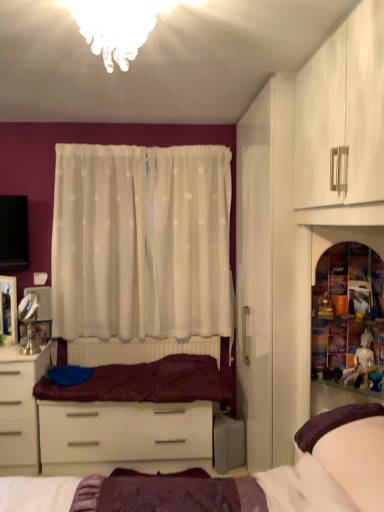
Question: Considering the relative positions of translucent glass shelf at right and white glossy desk at lower left in the image provided, is translucent glass shelf at right to the right of white glossy desk at lower left from the viewer's perspective?

Choices:
 (A) yes
 (B) no

Answer: (A)

Question: From the image's perspective, does translucent glass shelf at right appear lower than white glossy desk at lower left?

Choices:
 (A) no
 (B) yes

Answer: (A)

Question: Is translucent glass shelf at right thinner than white glossy desk at lower left?

Choices:
 (A) yes
 (B) no

Answer: (A)

Question: Is translucent glass shelf at right closer to the viewer compared to white glossy desk at lower left?

Choices:
 (A) no
 (B) yes

Answer: (B)

Question: Can you confirm if translucent glass shelf at right is taller than white glossy desk at lower left?

Choices:
 (A) yes
 (B) no

Answer: (A)

Question: Relative to white glossy drawer at center, is white glossy desk at lower left in front or behind?

Choices:
 (A) front
 (B) behind

Answer: (A)

Question: Is white glossy desk at lower left bigger or smaller than white glossy drawer at center?

Choices:
 (A) small
 (B) big

Answer: (A)

Question: From the image's perspective, relative to white glossy drawer at center, is white glossy desk at lower left above or below?

Choices:
 (A) above
 (B) below

Answer: (A)

Question: Based on their positions, is white glossy desk at lower left located to the left or right of white glossy drawer at center?

Choices:
 (A) right
 (B) left

Answer: (B)

Question: In the image, is maroon velvet blanket at center positioned in front of or behind translucent glass chandelier at upper center?

Choices:
 (A) front
 (B) behind

Answer: (B)

Question: In terms of width, does maroon velvet blanket at center look wider or thinner when compared to translucent glass chandelier at upper center?

Choices:
 (A) wide
 (B) thin

Answer: (A)

Question: Considering the positions of point (218, 398) and point (114, 3), is point (218, 398) closer or farther from the camera than point (114, 3)?

Choices:
 (A) farther
 (B) closer

Answer: (A)

Question: Is maroon velvet blanket at center taller or shorter than translucent glass chandelier at upper center?

Choices:
 (A) tall
 (B) short

Answer: (B)

Question: In the image, is white glossy drawer at center on the left side or the right side of white glossy desk at lower left?

Choices:
 (A) left
 (B) right

Answer: (B)

Question: Relative to white glossy desk at lower left, is white glossy drawer at center in front or behind?

Choices:
 (A) behind
 (B) front

Answer: (A)